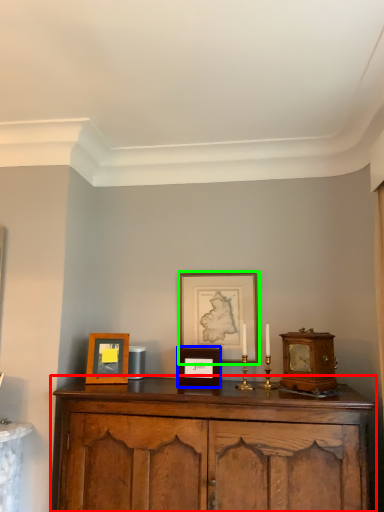
Question: Considering the real-world distances, which object is farthest from cabinetry (highlighted by a red box)? picture frame (highlighted by a blue box) or picture frame (highlighted by a green box)?

Choices:
 (A) picture frame
 (B) picture frame

Answer: (B)